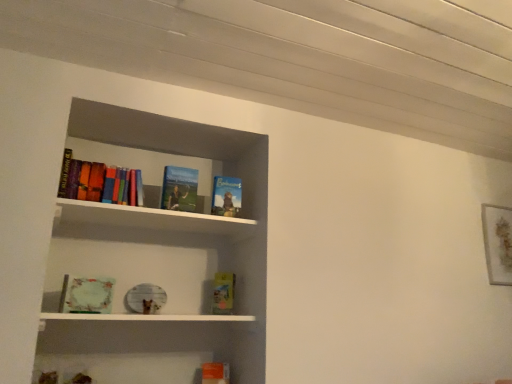
Question: Is multicolored hardcover books at upper left, the sixth book ordered from the bottom, shorter than hardcover book at center, marked as the 2th book in a bottom-to-top arrangement?

Choices:
 (A) yes
 (B) no

Answer: (B)

Question: Can you confirm if multicolored hardcover books at upper left, the sixth book ordered from the bottom, is taller than hardcover book at center, the fifth book viewed from the top?

Choices:
 (A) no
 (B) yes

Answer: (B)

Question: Is multicolored hardcover books at upper left, the sixth book ordered from the bottom, wider than hardcover book at center, the fifth book viewed from the top?

Choices:
 (A) yes
 (B) no

Answer: (A)

Question: Is multicolored hardcover books at upper left, the first book when ordered from top to bottom, facing towards hardcover book at center, the fifth book viewed from the top?

Choices:
 (A) yes
 (B) no

Answer: (B)

Question: Does multicolored hardcover books at upper left, the sixth book ordered from the bottom, have a lesser width compared to hardcover book at center, marked as the 2th book in a bottom-to-top arrangement?

Choices:
 (A) no
 (B) yes

Answer: (A)

Question: Based on their sizes in the image, would you say multicolored hardcover books at upper left, the sixth book ordered from the bottom, is bigger or smaller than hardcover book at upper center, which appears as the fifth book when ordered from the bottom?

Choices:
 (A) small
 (B) big

Answer: (B)

Question: Is point (113, 183) closer or farther from the camera than point (177, 190)?

Choices:
 (A) farther
 (B) closer

Answer: (B)

Question: Considering their positions, is multicolored hardcover books at upper left, the first book when ordered from top to bottom, located in front of or behind hardcover book at upper center, which appears as the fifth book when ordered from the bottom?

Choices:
 (A) behind
 (B) front

Answer: (B)

Question: Is multicolored hardcover books at upper left, the sixth book ordered from the bottom, taller or shorter than hardcover book at upper center, marked as the second book in a top-to-bottom arrangement?

Choices:
 (A) short
 (B) tall

Answer: (A)

Question: Looking at the image, does hardcover book at upper center, marked as the second book in a top-to-bottom arrangement, seem bigger or smaller compared to hardcover book at upper center, acting as the 3th book starting from the top?

Choices:
 (A) small
 (B) big

Answer: (B)

Question: In the image, is hardcover book at upper center, marked as the second book in a top-to-bottom arrangement, positioned in front of or behind hardcover book at upper center, acting as the 3th book starting from the top?

Choices:
 (A) front
 (B) behind

Answer: (A)

Question: Considering the positions of hardcover book at upper center, marked as the second book in a top-to-bottom arrangement, and hardcover book at upper center, acting as the 3th book starting from the top, in the image, is hardcover book at upper center, marked as the second book in a top-to-bottom arrangement, wider or thinner than hardcover book at upper center, acting as the 3th book starting from the top,?

Choices:
 (A) wide
 (B) thin

Answer: (A)

Question: Choose the correct answer: Is hardcover book at upper center, which appears as the fifth book when ordered from the bottom, inside hardcover book at upper center, arranged as the 4th book when ordered from the bottom, or outside it?

Choices:
 (A) inside
 (B) outside

Answer: (B)

Question: Is point (96, 289) closer or farther from the camera than point (222, 302)?

Choices:
 (A) farther
 (B) closer

Answer: (B)

Question: Is matte green book at lower left, which ranks as the 3th book in bottom-to-top order, bigger or smaller than hardcover book at center, marked as the 2th book in a bottom-to-top arrangement?

Choices:
 (A) big
 (B) small

Answer: (A)